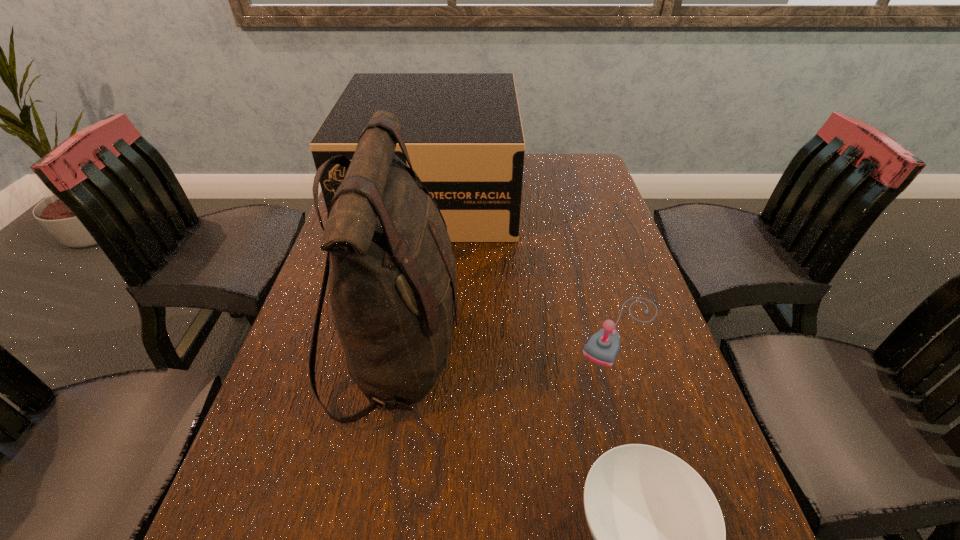
Where is `object that is at the right edge`? object that is at the right edge is located at coordinates (603, 347).

You are a GUI agent. You are given a task and a screenshot of the screen. Output one action in this format:
    pyautogui.click(x=<x>, y=<y>)
    Task: Click on the object that is at the far left corner
    This screenshot has height=540, width=960.
    Given the screenshot: What is the action you would take?
    pyautogui.click(x=463, y=133)

At what (x,y) coordinates should I click in order to perform the action: click on free region at the far edge of the desktop. Please return your answer as a coordinate pair (x, y). Looking at the image, I should click on (546, 180).

You are a GUI agent. You are given a task and a screenshot of the screen. Output one action in this format:
    pyautogui.click(x=<x>, y=<y>)
    Task: Click on the vacant area at the left edge of the desktop
    This screenshot has width=960, height=540.
    Given the screenshot: What is the action you would take?
    pyautogui.click(x=249, y=512)

In order to click on vacant space at the right edge of the desktop in this screenshot , I will do `click(612, 306)`.

In order to click on vacant area that lies between the joystick and the farthest object in this screenshot , I will do (527, 262).

Identify the location of unoccupied position between the joystick and the tallest object. The image size is (960, 540). (509, 341).

Where is `empty space between the tallest object and the joystick`? The width and height of the screenshot is (960, 540). empty space between the tallest object and the joystick is located at coordinates (509, 341).

Identify which object is the second closest to the nearest object. Please provide its 2D coordinates. Your answer should be formatted as a tuple, i.e. [(x, y)], where the tuple contains the x and y coordinates of a point satisfying the conditions above.

[(603, 347)]

Locate which object ranks second in proximity to the farthest object. Please provide its 2D coordinates. Your answer should be formatted as a tuple, i.e. [(x, y)], where the tuple contains the x and y coordinates of a point satisfying the conditions above.

[(603, 347)]